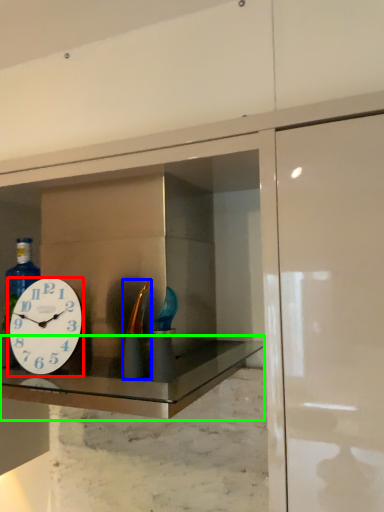
Question: Estimate the real-world distances between objects in this image. Which object is farther from wall clock (highlighted by a red box), bottle (highlighted by a blue box) or counter top (highlighted by a green box)?

Choices:
 (A) bottle
 (B) counter top

Answer: (A)